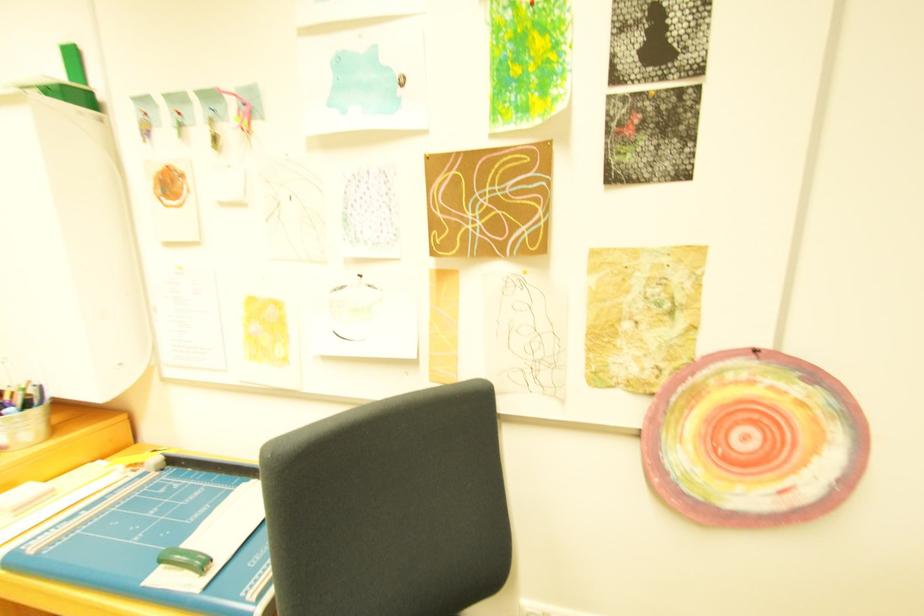
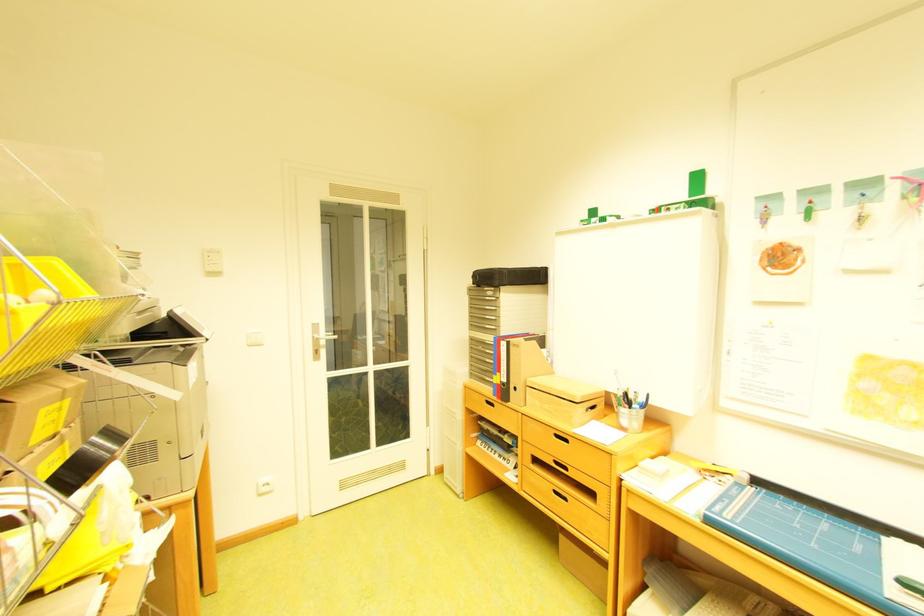
Find the pixel in the second image that matches (62,544) in the first image.

(747, 517)